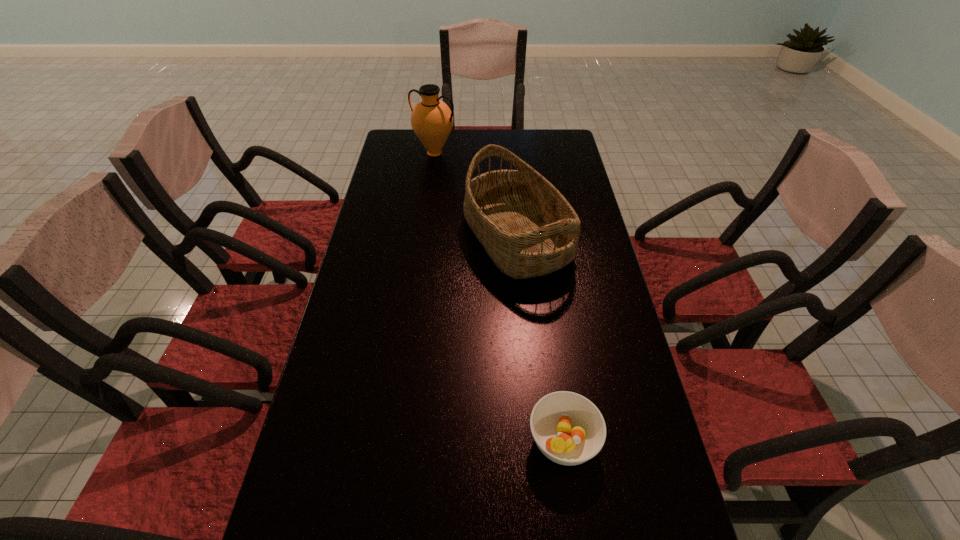
Locate an element on the screen. The width and height of the screenshot is (960, 540). the farthest object is located at coordinates pyautogui.click(x=432, y=120).

Where is `pitcher`? This screenshot has width=960, height=540. pitcher is located at coordinates (432, 120).

This screenshot has width=960, height=540. Identify the location of basket. (527, 227).

I want to click on the second farthest object, so click(x=527, y=227).

This screenshot has height=540, width=960. Find the location of `the nearest object`. the nearest object is located at coordinates (569, 429).

Image resolution: width=960 pixels, height=540 pixels. Find the location of `the shortest object`. the shortest object is located at coordinates (569, 429).

Locate an element on the screen. free space located on the right of the tallest object is located at coordinates coord(522,153).

Find the location of a particular element. This screenshot has height=540, width=960. free region located 0.180m on the front of the basket is located at coordinates (525, 336).

I want to click on vacant region located 0.060m on the front of the nearest object, so point(572,510).

You are a GUI agent. You are given a task and a screenshot of the screen. Output one action in this format:
    pyautogui.click(x=<x>, y=<y>)
    Task: Click on the object that is at the far edge
    
    Given the screenshot: What is the action you would take?
    pyautogui.click(x=432, y=120)